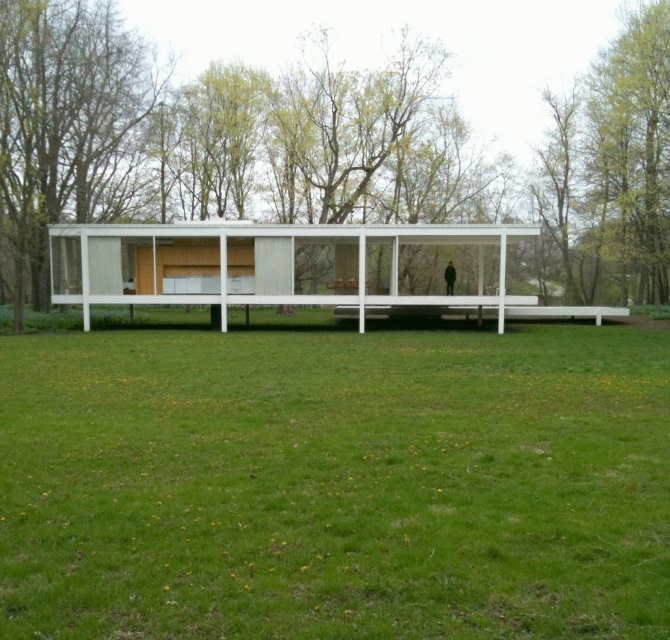
You are standing in front of the Farnsworth House and want to take a photo of the green leafy tree at center. To ensure the green grass at lower center is visible in the background, should you position yourself to the left or right of the tree?

You should position yourself to the left of the green leafy tree at center because the green grass at lower center is located to the left of the tree, placing it in the background when you stand there.

You are planning to install a walkway between the green leafy tree at center and the green leafy tree at left. The walkway will be 30 feet long. Will the walkway be long enough to connect both trees?

The green leafy tree at center and green leafy tree at left are 29.73 feet apart from each other. A 30 feet walkway is slightly longer than the distance between them, so it will be long enough to connect both trees.

You are standing at the entrance of the Farnsworth House and want to locate the green leafy tree at center. According to the coordinates provided, in which direction should you look to see it?

The green leafy tree at center is located at point coordinates, so you should look towards the center of the scene to see it.